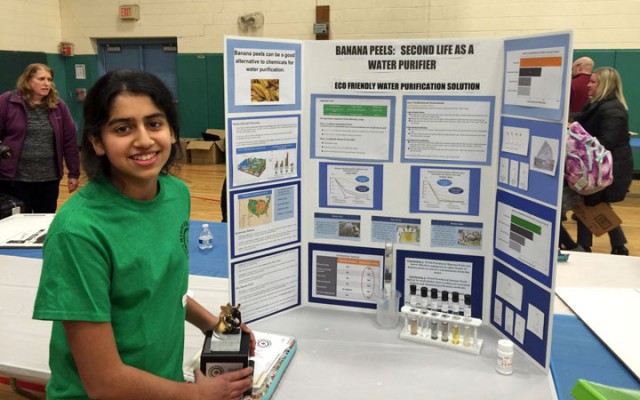
Where is `gymnasium wooden glossy floor`? This screenshot has height=400, width=640. gymnasium wooden glossy floor is located at coordinates (207, 191).